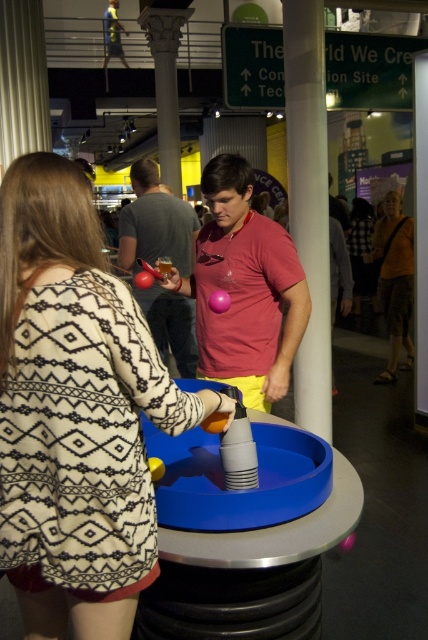
What is located at the coordinates point (244,289)?

The point (244,289) indicates the location of the pink rubber ball at center.